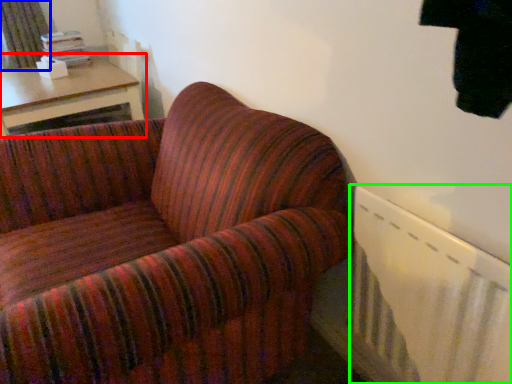
Question: Which object is positioned closest to table (highlighted by a red box)? Select from curtain (highlighted by a blue box) and radiator (highlighted by a green box).

Choices:
 (A) curtain
 (B) radiator

Answer: (A)